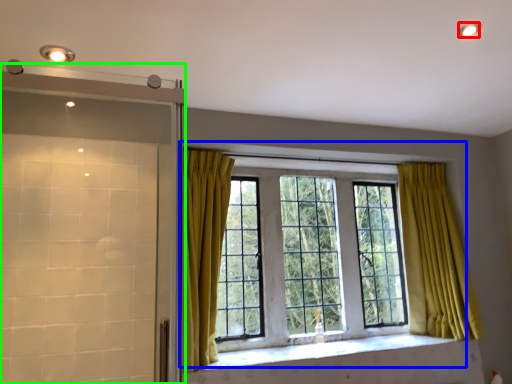
Question: Considering the real-world distances, which object is farthest from lighting (highlighted by a red box)? window (highlighted by a blue box) or screen door (highlighted by a green box)?

Choices:
 (A) window
 (B) screen door

Answer: (B)